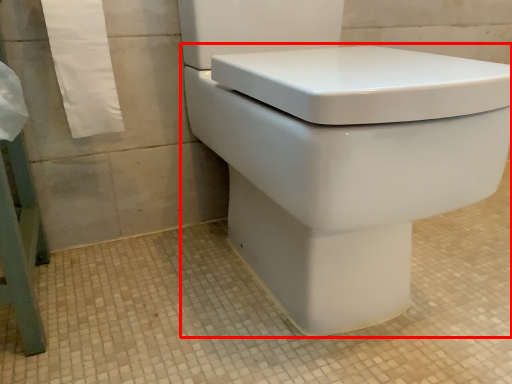
Question: From the image's perspective, where is toilet (annotated by the red box) located in relation to bath towel in the image?

Choices:
 (A) below
 (B) above

Answer: (A)